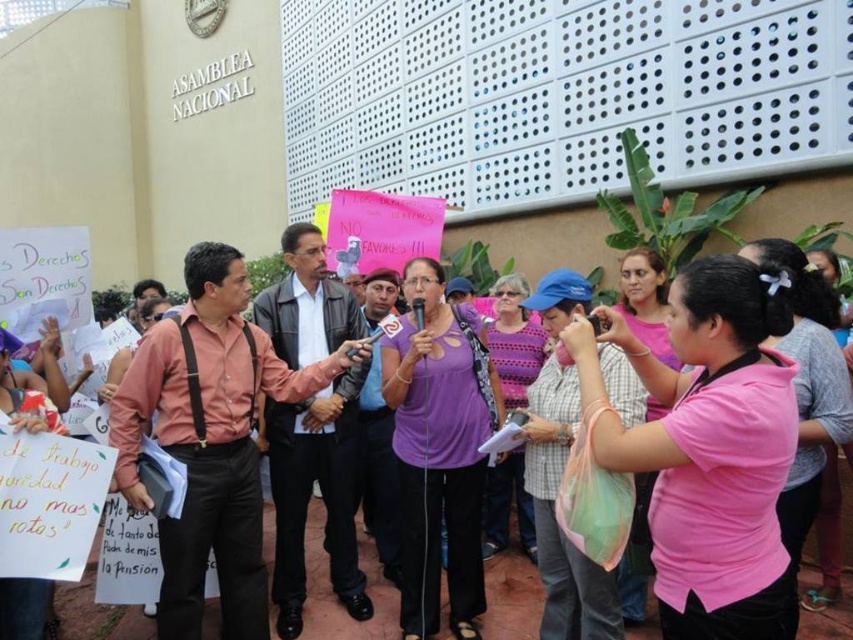
You are a photographer at the protest and want to take a photo of the person with the microphone and the matte pink shirt at center. Given that the matte pink shirt at center is located at point (x=210, y=440), where should you position your camera to capture both subjects in the frame?

To capture both the person with the microphone and the matte pink shirt at center, position your camera so that it includes the area around point (x=210, y=440) where the matte pink shirt is located, ensuring the microphone holder is also within the frame.